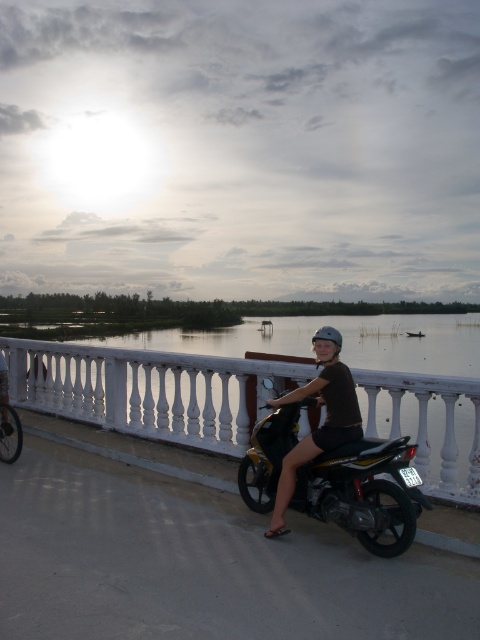
Does white balustrade at center appear under metallic silver bicycle at center?

No.

Does white balustrade at center have a greater width compared to metallic silver bicycle at center?

In fact, white balustrade at center might be narrower than metallic silver bicycle at center.

Between point (446, 461) and point (14, 435), which one is positioned behind?

The point (14, 435) is more distant.

Locate an element on the screen. white balustrade at center is located at coordinates (146, 388).

Is matte black helmet at upper center smaller than metallic silver bicycle at center?

No.

This screenshot has height=640, width=480. I want to click on matte black helmet at upper center, so click(324, 420).

Between shiny metallic motorcycle at center and matte black helmet at upper center, which one is positioned higher?

matte black helmet at upper center is higher up.

Which is below, shiny metallic motorcycle at center or matte black helmet at upper center?

Positioned lower is shiny metallic motorcycle at center.

Find the location of a particular element. The image size is (480, 640). shiny metallic motorcycle at center is located at coordinates (363, 492).